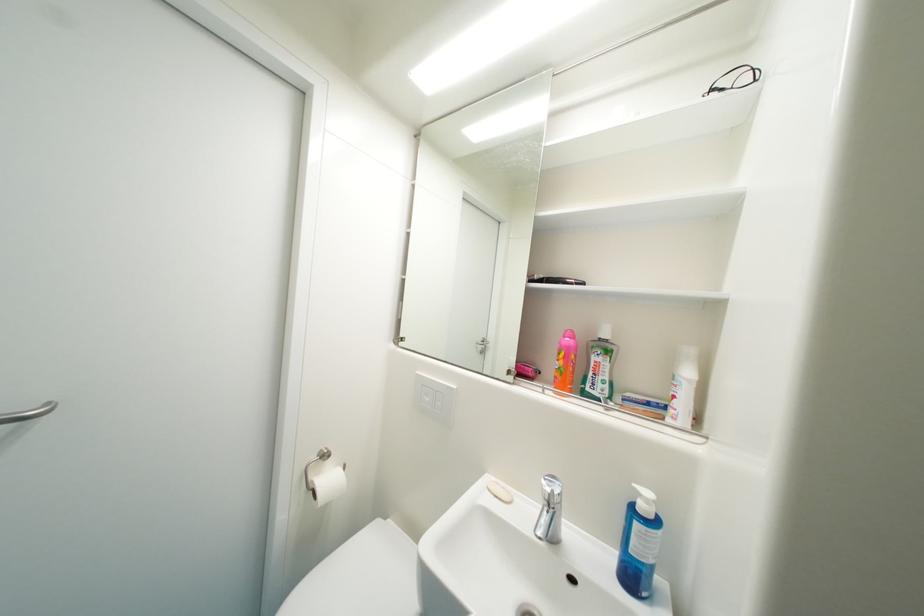
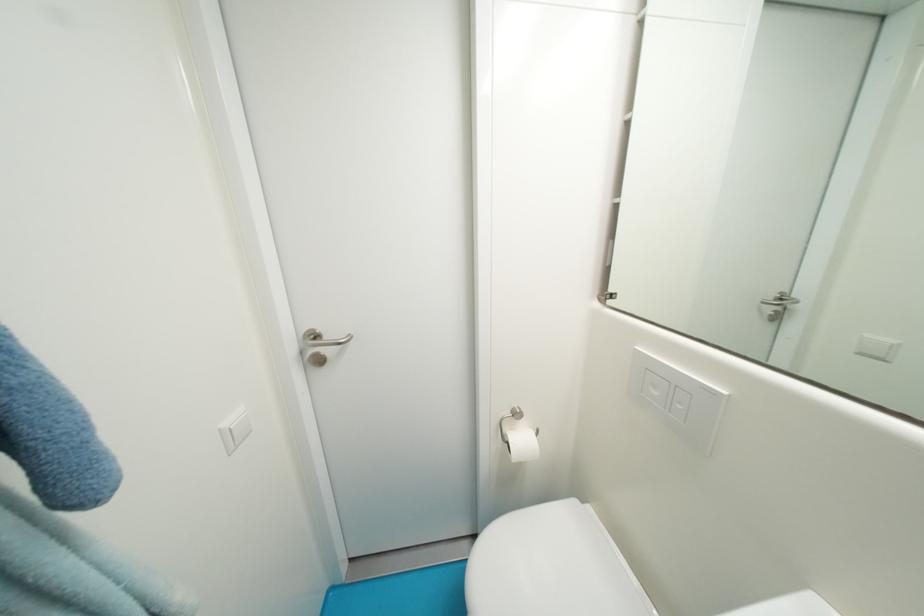
Find the pixel in the second image that matches (x=433, y=400) in the first image.

(662, 395)